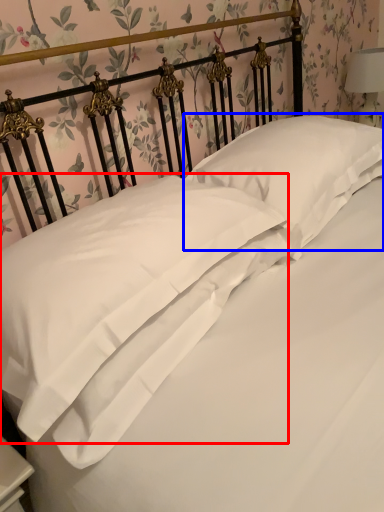
Question: Which object appears closest to the camera in this image, pillow (highlighted by a red box) or pillow (highlighted by a blue box)?

Choices:
 (A) pillow
 (B) pillow

Answer: (A)